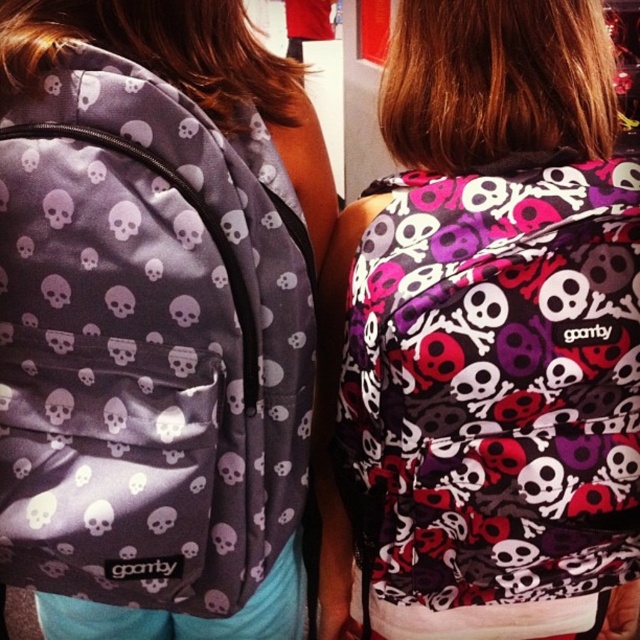
Question: Which object appears closest to the camera in this image?

Choices:
 (A) matte purple backpack at center
 (B) matte purple skull-patterned backpack at upper left

Answer: (B)

Question: Is matte purple backpack at center in front of matte purple skull-patterned backpack at upper left?

Choices:
 (A) no
 (B) yes

Answer: (A)

Question: Can you confirm if matte purple backpack at center is smaller than matte purple skull-patterned backpack at upper left?

Choices:
 (A) no
 (B) yes

Answer: (A)

Question: Is matte purple backpack at center wider than matte purple skull-patterned backpack at upper left?

Choices:
 (A) no
 (B) yes

Answer: (B)

Question: Which of the following is the closest to the observer?

Choices:
 (A) (493, 456)
 (B) (186, 424)

Answer: (B)

Question: Which point is farther to the camera?

Choices:
 (A) (10, 333)
 (B) (592, 22)

Answer: (B)